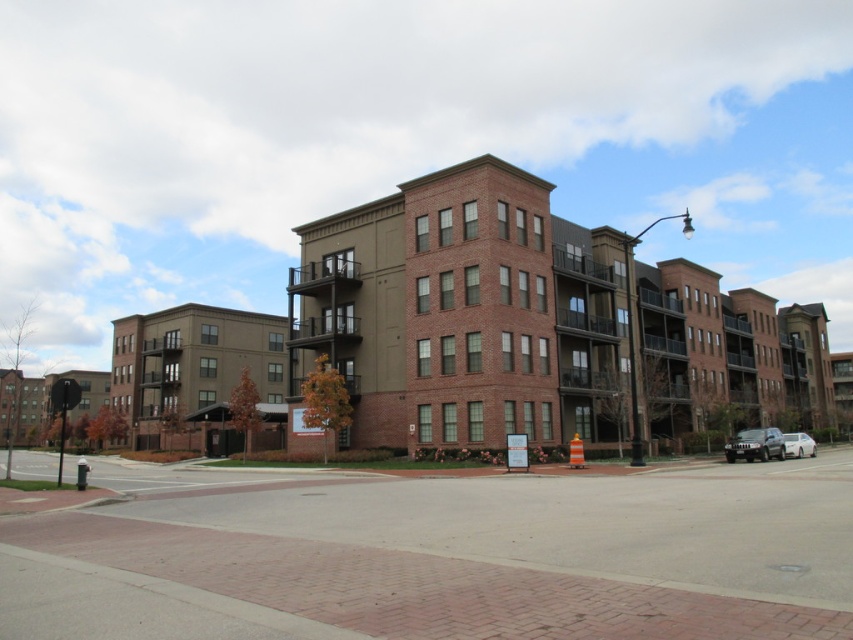
You are a pedestrian approaching the building and see the metallic silver suv at lower right and the white glossy sedan at right. Which vehicle is closer to the entrance of the building?

The metallic silver suv at lower right is closer to the entrance of the building because it is in front of the white glossy sedan at right, which is further back.

You are a delivery driver who needs to park your metallic silver suv at lower right near the building entrance. The parking spot is at coordinate point 0.695, 0.886. Is your vehicle already parked correctly?

The metallic silver suv at lower right is already positioned at point (x=755, y=444), which matches the parking spot coordinates. Therefore, the vehicle is correctly parked.

You are a delivery driver approaching the building and need to park your vehicle. You see a metallic silver suv at lower right and a white glossy sedan at right. Which vehicle takes up more space in the parking spot?

The white glossy sedan at right takes up more space in the parking spot because it is larger than the metallic silver suv at lower right.